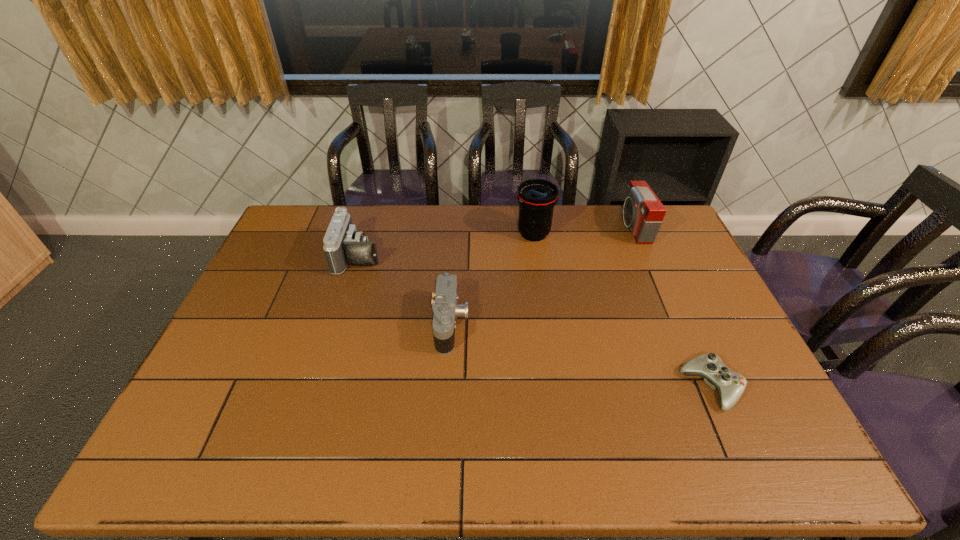
The width and height of the screenshot is (960, 540). In order to click on vacant space located 0.190m on the front-facing side of the rightmost camera in this screenshot , I will do `click(570, 227)`.

At what (x,y) coordinates should I click in order to perform the action: click on free spot located 0.270m on the front-facing side of the rightmost camera. Please return your answer as a coordinate pair (x, y). Looking at the image, I should click on (549, 227).

Where is `blank area located 0.210m at the front of the leftmost object with an open lens cover`? The width and height of the screenshot is (960, 540). blank area located 0.210m at the front of the leftmost object with an open lens cover is located at coordinates (444, 255).

You are a GUI agent. You are given a task and a screenshot of the screen. Output one action in this format:
    pyautogui.click(x=<x>, y=<y>)
    Task: Click on the vacant space situated on the lens of the fourth object from right to left
    The width and height of the screenshot is (960, 540).
    Given the screenshot: What is the action you would take?
    point(588,324)

You are a GUI agent. You are given a task and a screenshot of the screen. Output one action in this format:
    pyautogui.click(x=<x>, y=<y>)
    Task: Click on the blank space located on the front of the shortest object
    This screenshot has width=960, height=540.
    Given the screenshot: What is the action you would take?
    pyautogui.click(x=733, y=436)

The width and height of the screenshot is (960, 540). Find the location of `telephoto lens positioned at the far edge`. telephoto lens positioned at the far edge is located at coordinates (536, 197).

Find the location of a particular element. Image resolution: width=960 pixels, height=540 pixels. camera present at the right edge is located at coordinates (643, 212).

Where is `control that is positioned at the right edge`? Image resolution: width=960 pixels, height=540 pixels. control that is positioned at the right edge is located at coordinates (730, 385).

Where is `object located in the far right corner section of the desktop`? The image size is (960, 540). object located in the far right corner section of the desktop is located at coordinates pyautogui.click(x=643, y=212).

The height and width of the screenshot is (540, 960). I want to click on free space at the far edge of the desktop, so click(x=607, y=242).